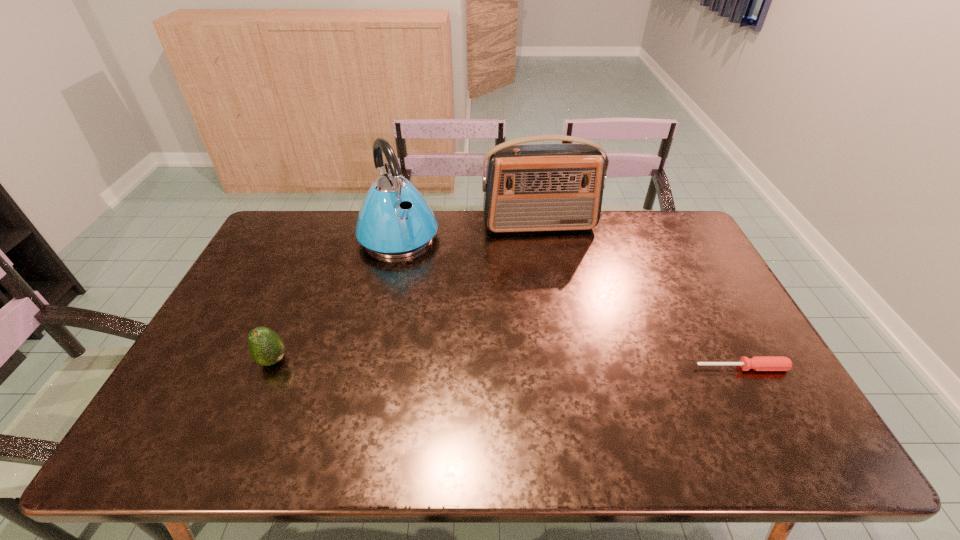
Where is `free space between the kettle and the third object from left to right`? This screenshot has height=540, width=960. free space between the kettle and the third object from left to right is located at coordinates (468, 231).

I want to click on vacant space in between the third tallest object and the second object from right to left, so click(406, 293).

The image size is (960, 540). Identify the location of empty space that is in between the kettle and the radio receiver. (468, 231).

At what (x,y) coordinates should I click in order to perform the action: click on empty space between the avocado and the screwdriver. Please return your answer as a coordinate pair (x, y). The width and height of the screenshot is (960, 540). Looking at the image, I should click on (508, 364).

Find the location of a particular element. The image size is (960, 540). vacant space that is in between the shortest object and the second shortest object is located at coordinates (508, 364).

At what (x,y) coordinates should I click in order to perform the action: click on free space between the leftmost object and the second object from right to left. Please return your answer as a coordinate pair (x, y). Looking at the image, I should click on (406, 293).

Where is `unoccupied area between the second object from right to left and the kettle`? unoccupied area between the second object from right to left and the kettle is located at coordinates (468, 231).

The image size is (960, 540). What are the coordinates of `free space that is in between the avocado and the rightmost object` in the screenshot? It's located at (508, 364).

What are the coordinates of `blank region between the third tallest object and the second object from right to left` in the screenshot? It's located at (406, 293).

Locate an element on the screen. The image size is (960, 540). free spot between the leftmost object and the screwdriver is located at coordinates (508, 364).